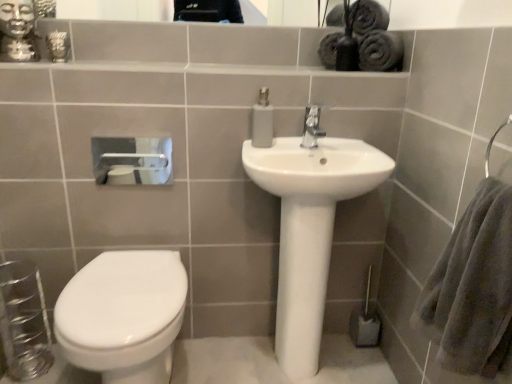
Question: Is white glossy toilet at lower left far away from gray fluffy bath towel at right?

Choices:
 (A) no
 (B) yes

Answer: (A)

Question: Is white glossy toilet at lower left to the right of gray fluffy bath towel at right from the viewer's perspective?

Choices:
 (A) yes
 (B) no

Answer: (B)

Question: Is white glossy toilet at lower left outside gray fluffy bath towel at right?

Choices:
 (A) no
 (B) yes

Answer: (B)

Question: Is the position of white glossy toilet at lower left less distant than that of gray fluffy bath towel at right?

Choices:
 (A) yes
 (B) no

Answer: (B)

Question: Does white glossy toilet at lower left have a greater width compared to gray fluffy bath towel at right?

Choices:
 (A) yes
 (B) no

Answer: (A)

Question: Which is correct: gold metallic statue at upper left is inside glossy ceramic mirror at upper center, or outside of it?

Choices:
 (A) inside
 (B) outside

Answer: (B)

Question: Considering their positions, is gold metallic statue at upper left located in front of or behind glossy ceramic mirror at upper center?

Choices:
 (A) behind
 (B) front

Answer: (B)

Question: From the image's perspective, is gold metallic statue at upper left positioned above or below glossy ceramic mirror at upper center?

Choices:
 (A) above
 (B) below

Answer: (B)

Question: Is gold metallic statue at upper left taller or shorter than glossy ceramic mirror at upper center?

Choices:
 (A) tall
 (B) short

Answer: (A)

Question: Based on their sizes in the image, would you say white glossy toilet at lower left is bigger or smaller than gold metallic statue at upper left?

Choices:
 (A) small
 (B) big

Answer: (B)

Question: From a real-world perspective, is white glossy toilet at lower left physically located above or below gold metallic statue at upper left?

Choices:
 (A) above
 (B) below

Answer: (B)

Question: From the image's perspective, is white glossy toilet at lower left located above or below gold metallic statue at upper left?

Choices:
 (A) above
 (B) below

Answer: (B)

Question: In terms of height, does white glossy toilet at lower left look taller or shorter compared to gold metallic statue at upper left?

Choices:
 (A) short
 (B) tall

Answer: (B)

Question: Considering their positions, is glossy ceramic mirror at upper center located in front of or behind white matte toilet paper at upper left?

Choices:
 (A) front
 (B) behind

Answer: (B)

Question: Is glossy ceramic mirror at upper center to the left or to the right of white matte toilet paper at upper left in the image?

Choices:
 (A) left
 (B) right

Answer: (B)